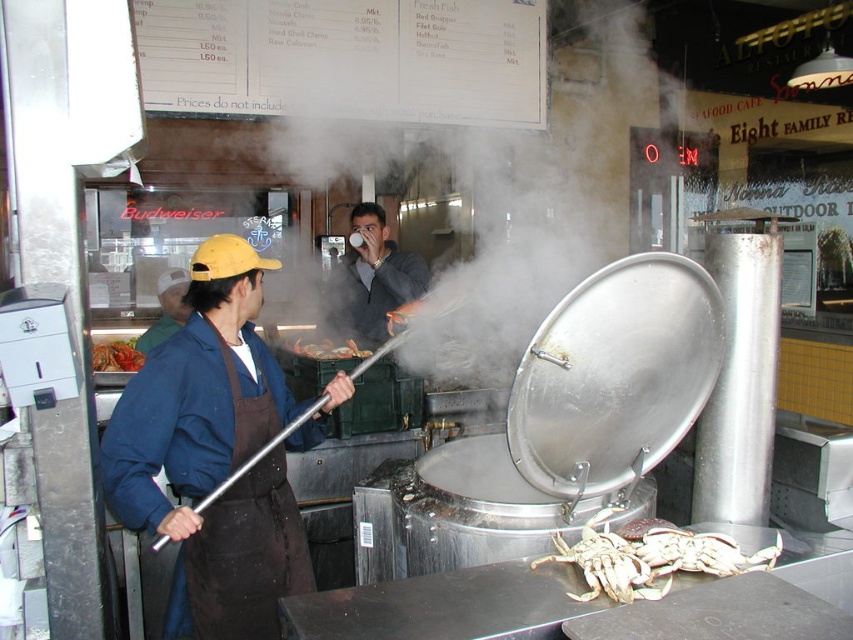
Question: Which object appears farthest from the camera in this image?

Choices:
 (A) white vapor at center
 (B) matte gray sweater at center
 (C) brown canvas apron at center

Answer: (B)

Question: Can you confirm if brown canvas apron at center is smaller than shiny silver crab at lower right?

Choices:
 (A) no
 (B) yes

Answer: (A)

Question: Is matte gray sweater at center below shiny silver crab at center?

Choices:
 (A) no
 (B) yes

Answer: (A)

Question: Considering the real-world distances, which object is farthest from the white vapor at center?

Choices:
 (A) brown canvas apron at center
 (B) brown apron at left

Answer: (B)

Question: Which object is the closest to the red lobster at center?

Choices:
 (A) brown apron at left
 (B) shiny silver crab at lower right

Answer: (A)

Question: Does matte gray sweater at center lie behind brown apron at left?

Choices:
 (A) no
 (B) yes

Answer: (B)